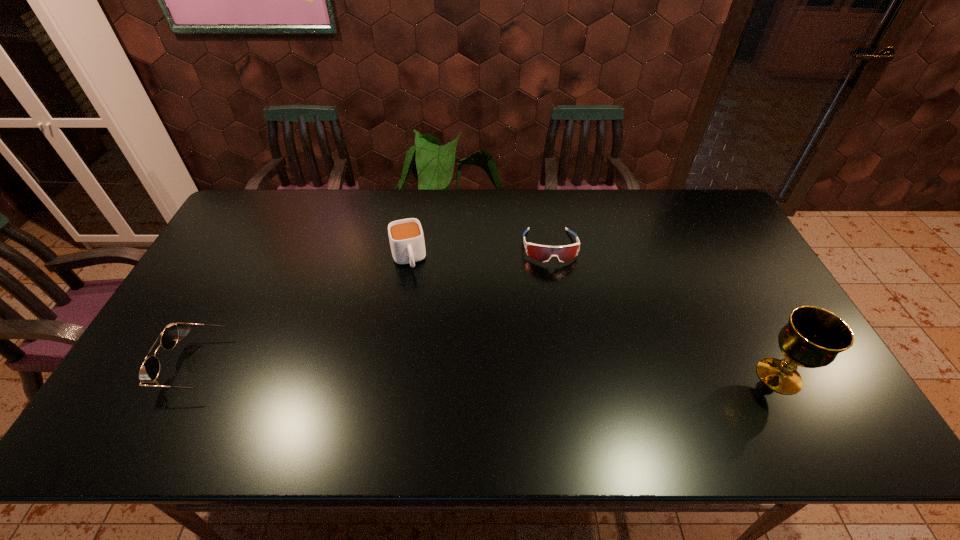
Image resolution: width=960 pixels, height=540 pixels. I want to click on vacant point that satisfies the following two spatial constraints: 1. on the front side of the rightmost object; 2. on the right side of the second object from left to right, so click(389, 376).

Image resolution: width=960 pixels, height=540 pixels. Identify the location of vacant space that satisfies the following two spatial constraints: 1. on the front side of the chalice; 2. on the right side of the cup. (389, 376).